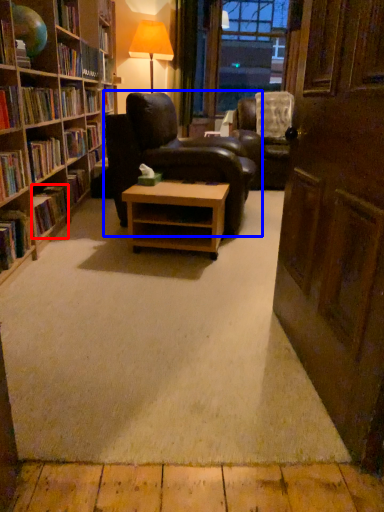
Question: Which point is further to the camera, book (highlighted by a red box) or chair (highlighted by a blue box)?

Choices:
 (A) book
 (B) chair

Answer: (B)